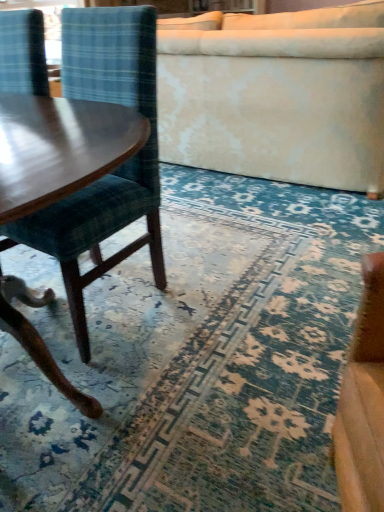
Question: Is velvet plaid chair at left positioned behind blue textured rug at center?

Choices:
 (A) no
 (B) yes

Answer: (B)

Question: Can you confirm if velvet plaid chair at left is positioned to the right of blue textured rug at center?

Choices:
 (A) no
 (B) yes

Answer: (A)

Question: Is velvet plaid chair at left in contact with blue textured rug at center?

Choices:
 (A) yes
 (B) no

Answer: (B)

Question: Is velvet plaid chair at left shorter than blue textured rug at center?

Choices:
 (A) no
 (B) yes

Answer: (A)

Question: Can you confirm if velvet plaid chair at left is thinner than blue textured rug at center?

Choices:
 (A) no
 (B) yes

Answer: (B)

Question: Relative to velvet plaid chair at left, is velvet cream studio couch at upper center in front or behind?

Choices:
 (A) front
 (B) behind

Answer: (B)

Question: Is velvet cream studio couch at upper center to the left or to the right of velvet plaid chair at left in the image?

Choices:
 (A) left
 (B) right

Answer: (B)

Question: In terms of width, does velvet cream studio couch at upper center look wider or thinner when compared to velvet plaid chair at left?

Choices:
 (A) wide
 (B) thin

Answer: (A)

Question: Is velvet cream studio couch at upper center taller or shorter than velvet plaid chair at left?

Choices:
 (A) short
 (B) tall

Answer: (A)

Question: From the image's perspective, is velvet plaid chair at left positioned above or below velvet cream studio couch at upper center?

Choices:
 (A) above
 (B) below

Answer: (B)

Question: In terms of width, does velvet plaid chair at left look wider or thinner when compared to velvet cream studio couch at upper center?

Choices:
 (A) wide
 (B) thin

Answer: (B)

Question: From their relative heights in the image, would you say velvet plaid chair at left is taller or shorter than velvet cream studio couch at upper center?

Choices:
 (A) tall
 (B) short

Answer: (A)

Question: Does point (132, 178) appear closer or farther from the camera than point (357, 150)?

Choices:
 (A) closer
 (B) farther

Answer: (A)

Question: Is velvet plaid chair at left bigger or smaller than blue textured rug at center?

Choices:
 (A) small
 (B) big

Answer: (B)

Question: Based on their positions, is velvet plaid chair at left located to the left or right of blue textured rug at center?

Choices:
 (A) right
 (B) left

Answer: (B)